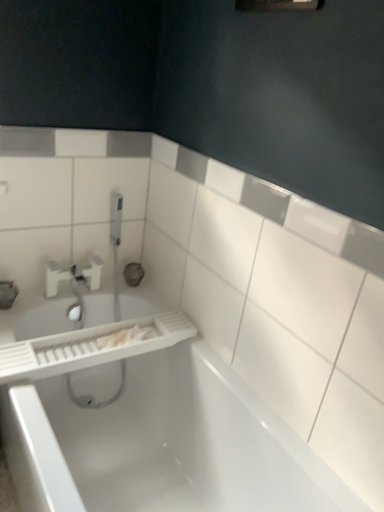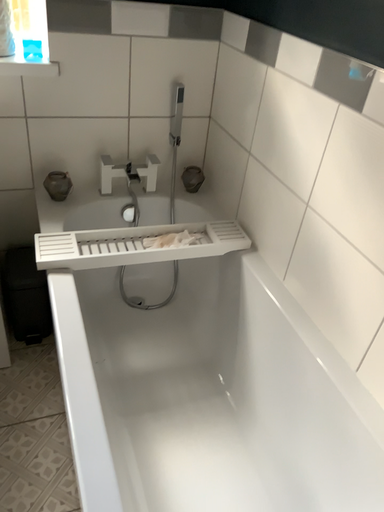
Question: Which way did the camera rotate in the video?

Choices:
 (A) rotated left
 (B) rotated right

Answer: (A)